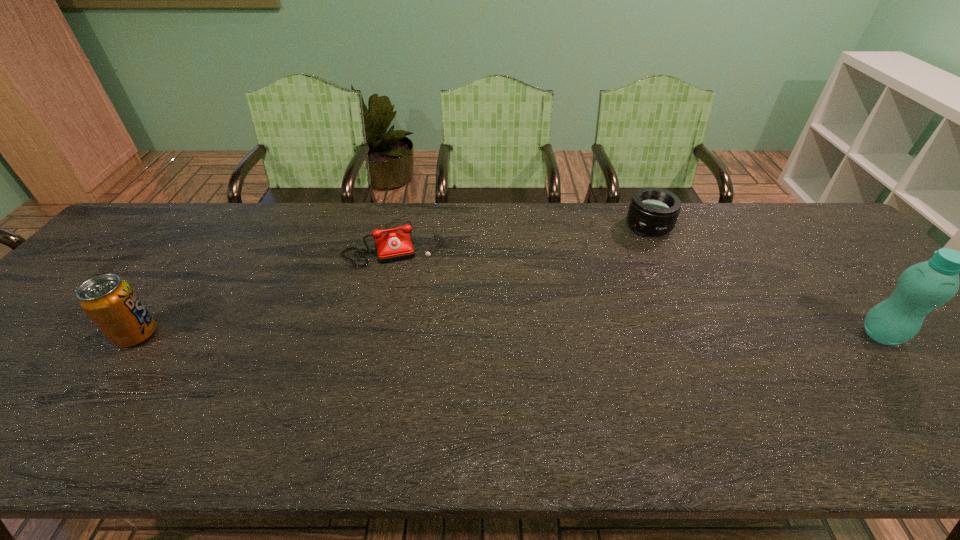
Where is `vacant space on the desktop that is between the leftmost object and the tallest object and is positioned on the dial of the telephone`? vacant space on the desktop that is between the leftmost object and the tallest object and is positioned on the dial of the telephone is located at coordinates point(417,334).

Locate an element on the screen. free spot on the desktop that is between the second tallest object and the tallest object and is positioned on the side of the telephoto lens with brand markings and control switches is located at coordinates (593, 335).